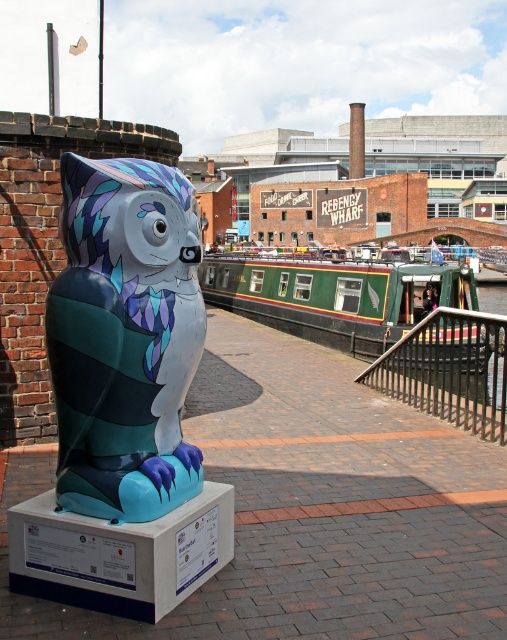
Question: Is shiny metallic cat at center to the right of black metal/rail at lower right from the viewer's perspective?

Choices:
 (A) yes
 (B) no

Answer: (B)

Question: Which of the following is the closest to the observer?

Choices:
 (A) (414, 397)
 (B) (110, 428)
 (C) (449, 294)

Answer: (B)

Question: Which of the following is the farthest from the observer?

Choices:
 (A) green polished wood barge at center
 (B) black metal/rail at lower right

Answer: (A)

Question: Is green polished wood barge at center positioned behind black metal/rail at lower right?

Choices:
 (A) yes
 (B) no

Answer: (A)

Question: Which object is farther from the camera taking this photo?

Choices:
 (A) shiny metallic cat at center
 (B) green polished wood barge at center
 (C) black metal/rail at lower right

Answer: (B)

Question: Can you confirm if green polished wood barge at center is thinner than black metal/rail at lower right?

Choices:
 (A) yes
 (B) no

Answer: (B)